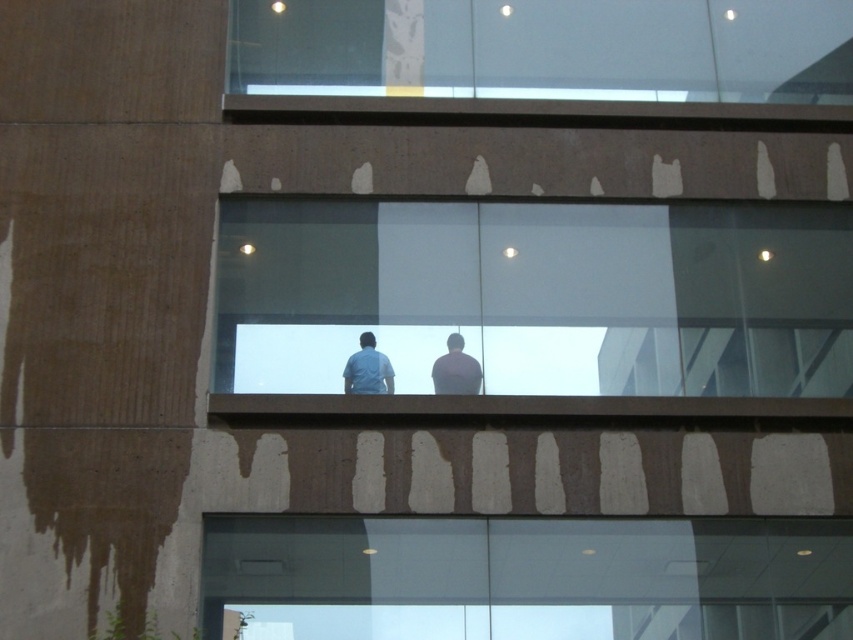
You are a construction worker observing two workers through the glass. You notice their shirts labeled as light blue shirt at center and smooth gray shirt at center. Which worker is shorter?

The light blue shirt at center has a lesser height compared to the smooth gray shirt at center, so the worker wearing the light blue shirt at center is shorter.

You are an inspector checking the construction site. You notice two points marked on the facade at coordinates point (387, 388) and point (438, 381). Which point is closer to the entrance located at the base of the building?

Point (387, 388) is in front of point (438, 381), so it is closer to the entrance at the base of the building.

Consider the image. You are an architect inspecting the building. You notice the transparent glass window at lower center and the light blue shirt at center. Which object is taller?

The transparent glass window at lower center is taller than the light blue shirt at center.